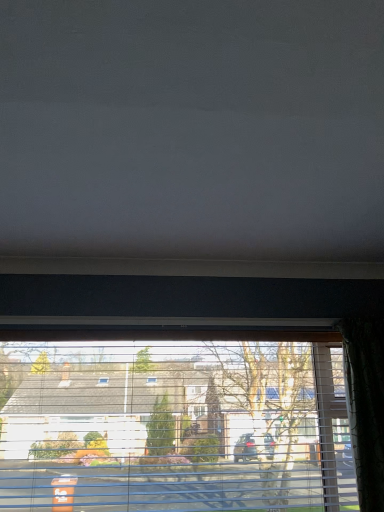
Question: In terms of height, does matte gray blind at upper center look taller or shorter compared to transparent plastic window at center?

Choices:
 (A) tall
 (B) short

Answer: (B)

Question: Looking at their shapes, would you say matte gray blind at upper center is wider or thinner than transparent plastic window at center?

Choices:
 (A) wide
 (B) thin

Answer: (A)

Question: In the image, is matte gray blind at upper center on the left side or the right side of transparent plastic window at center?

Choices:
 (A) right
 (B) left

Answer: (A)

Question: Considering the positions of transparent plastic window at center and matte gray blind at upper center in the image, is transparent plastic window at center bigger or smaller than matte gray blind at upper center?

Choices:
 (A) small
 (B) big

Answer: (A)

Question: From a real-world perspective, is transparent plastic window at center above or below matte gray blind at upper center?

Choices:
 (A) above
 (B) below

Answer: (B)

Question: Would you say transparent plastic window at center is to the left or to the right of matte gray blind at upper center in the picture?

Choices:
 (A) right
 (B) left

Answer: (B)

Question: From the image's perspective, is transparent plastic window at center above or below matte gray blind at upper center?

Choices:
 (A) above
 (B) below

Answer: (B)